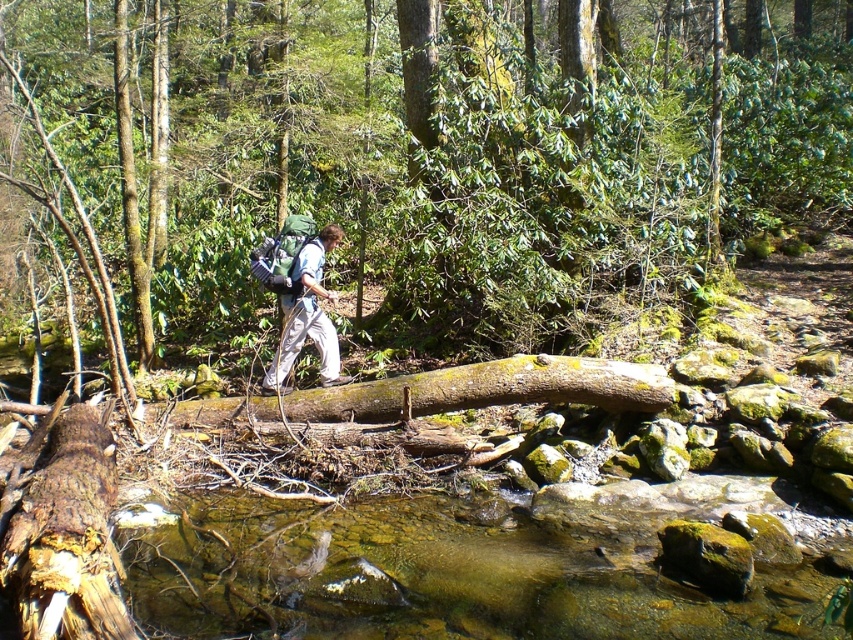
You are a hiker trying to cross a stream in the forest. You see a smooth brown log at center and a brown rough tree trunk at lower left. Which object is bigger and would be more stable to walk on?

The smooth brown log at center is larger in size compared to the brown rough tree trunk at lower left, making it more stable to walk on.

You are a hiker trying to cross the brown rough tree trunk at lower left. You have a green fabric backpack at center. Which object is closer to the ground?

The brown rough tree trunk at lower left is closer to the ground because it is positioned below the green fabric backpack at center.